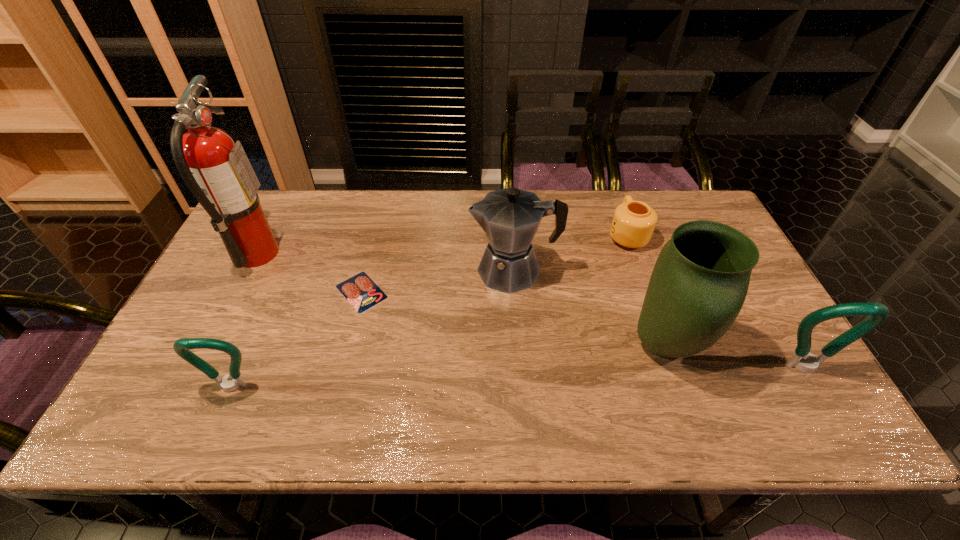
To achieve even spacing by inserting another bottle_opener among them, please point to a vacant spot for this new bottle_opener. Please provide its 2D coordinates. Your answer should be formatted as a tuple, i.e. [(x, y)], where the tuple contains the x and y coordinates of a point satisfying the conditions above.

[(523, 378)]